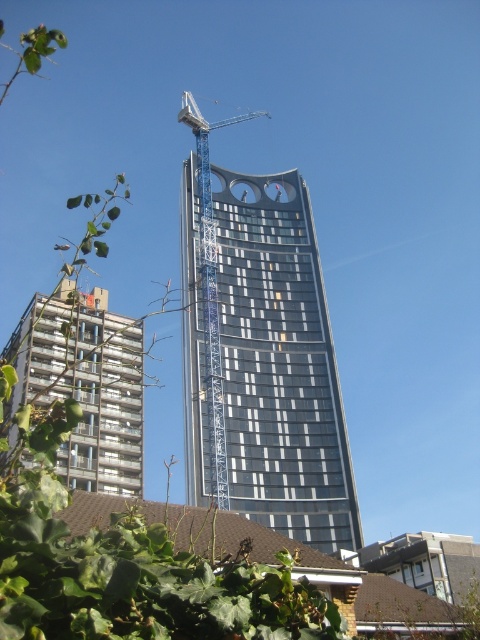
You are an architect analyzing the urban skyline. You notice the glassy steel tower at center and the metallic silver building at lower left. Which of these two structures has a greater height?

The glassy steel tower at center is much taller than the metallic silver building at lower left, so it has a greater height.

You are standing in front of the skyscraper and want to reach the point marked at coordinates point (60, 451). Given that your maximum reach is 60 meters, can you touch it?

The point (60, 451) is 69.15 meters away from you, which exceeds your maximum reach of 60 meters. Therefore, you cannot touch it.

You are a construction worker looking to move a heavy load from the ground to the top of the metallic silver building at lower left. The blue metallic crane at center is available. Can the crane reach the building?

The metallic silver building at lower left is below the blue metallic crane at center, so the crane can reach it.